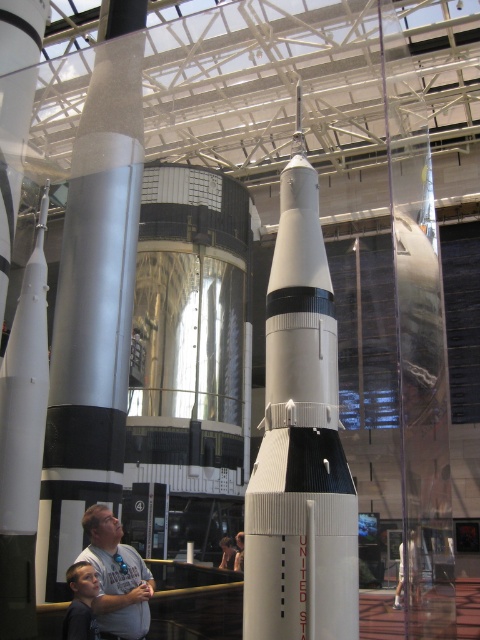
From the picture: Which of these two, silver/reflective/rocket at left or gray fabric shirt at lower center, stands shorter?

With less height is gray fabric shirt at lower center.

Who is more distant from viewer, (72, 538) or (226, 557)?

Point (226, 557)

Is point (94, 125) farther from viewer compared to point (231, 566)?

That is False.

Find the location of `silver/reflective/rocket at left`. silver/reflective/rocket at left is located at coordinates (94, 300).

Consider the image. Between light brown hair at lower left and gray fabric shirt at lower center, which one appears on the left side from the viewer's perspective?

Positioned to the left is light brown hair at lower left.

What do you see at coordinates (81, 602) in the screenshot? I see `light brown hair at lower left` at bounding box center [81, 602].

Is point (74, 582) positioned after point (232, 561)?

No, (74, 582) is closer to viewer.

Locate an element on the screen. The image size is (480, 640). light brown hair at lower left is located at coordinates (81, 602).

Between silver/reflective/rocket at left and light brown leather jacket at center, which one is positioned lower?

light brown leather jacket at center is lower down.

Does silver/reflective/rocket at left appear under light brown leather jacket at center?

Actually, silver/reflective/rocket at left is above light brown leather jacket at center.

Is point (36, 586) closer to camera compared to point (240, 541)?

Yes, point (36, 586) is in front of point (240, 541).

Find the location of a particular element. The image size is (480, 640). silver/reflective/rocket at left is located at coordinates tap(94, 300).